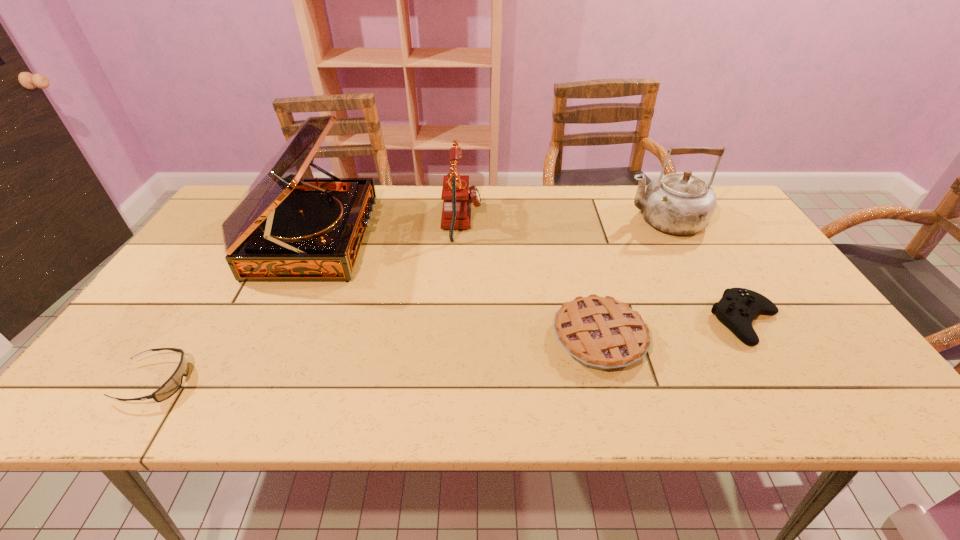
Find the location of a particular element. This screenshot has width=960, height=540. unoccupied position between the control and the pie is located at coordinates (673, 329).

The image size is (960, 540). What are the coordinates of `object that is the closest to the control` in the screenshot? It's located at (602, 333).

Locate an element on the screen. This screenshot has height=540, width=960. the third closest object to the goggles is located at coordinates (602, 333).

Identify the location of vacant space that satisfies the following two spatial constraints: 1. on the back side of the control; 2. on the front-facing side of the tallest object. (696, 238).

Find the location of a particular element. The height and width of the screenshot is (540, 960). vacant space that satisfies the following two spatial constraints: 1. at the spout of the kettle; 2. on the dial of the telephone is located at coordinates (663, 220).

Where is `free space that satisfies the following two spatial constraints: 1. on the dial of the fourth object from left to right; 2. on the left side of the telephone`? The height and width of the screenshot is (540, 960). free space that satisfies the following two spatial constraints: 1. on the dial of the fourth object from left to right; 2. on the left side of the telephone is located at coordinates (456, 338).

I want to click on free location that satisfies the following two spatial constraints: 1. on the back side of the pie; 2. on the dial of the fourth object from right to left, so click(568, 220).

Identify the location of vacant region that satisfies the following two spatial constraints: 1. on the front-facing side of the control; 2. on the left side of the record player. This screenshot has height=540, width=960. (276, 321).

Image resolution: width=960 pixels, height=540 pixels. I want to click on free spot that satisfies the following two spatial constraints: 1. on the front-facing side of the control; 2. on the left side of the record player, so click(x=276, y=321).